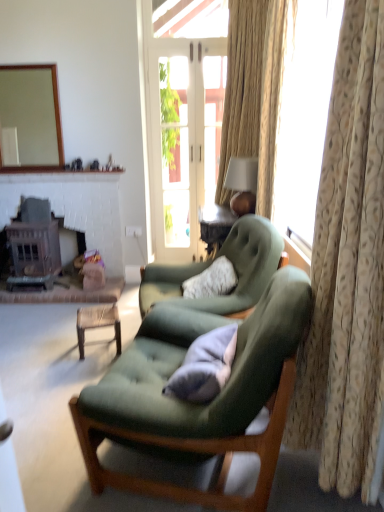
Question: Is velvet green armchair at center, marked as the first chair in a back-to-front arrangement, inside the boundaries of matte brown lampshade at upper right, or outside?

Choices:
 (A) inside
 (B) outside

Answer: (B)

Question: Considering their positions, is velvet green armchair at center, arranged as the 2th chair when viewed from the front, located in front of or behind matte brown lampshade at upper right?

Choices:
 (A) front
 (B) behind

Answer: (A)

Question: Which of these objects is positioned closest to the beige floral fabric curtain at right, which is counted as the second curtain, starting from the back?

Choices:
 (A) velvet green chair at center, the second chair when ordered from back to front
 (B) wooden table at center
 (C) matte brown lampshade at upper right
 (D) soft gray cushion at center
 (E) white plastic power outlet at center

Answer: (A)

Question: Which object is the closest to the wooden table at center?

Choices:
 (A) dark brown wood fireplace at lower left, the 2th fireplace positioned from the right
 (B) light beige textured curtain at right, which is counted as the first curtain, starting from the back
 (C) beige floral fabric curtain at right, which is counted as the second curtain, starting from the back
 (D) matte brown lampshade at upper right
 (E) rustic wood fireplace at left, arranged as the 1th fireplace when viewed from the right

Answer: (A)